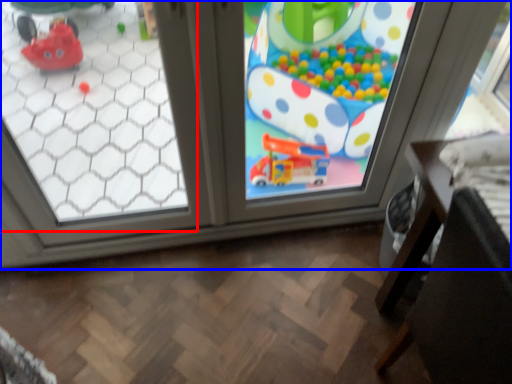
Question: Which object appears closest to the camera in this image, window (highlighted by a red box) or window (highlighted by a blue box)?

Choices:
 (A) window
 (B) window

Answer: (A)